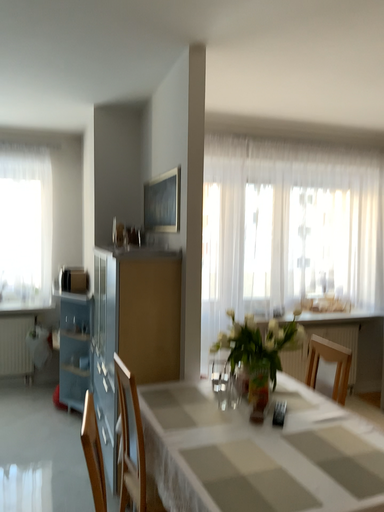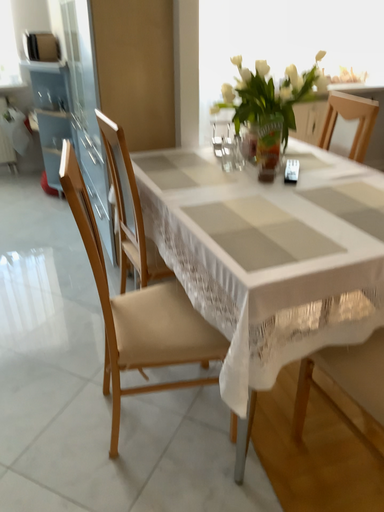
Question: How did the camera likely rotate when shooting the video?

Choices:
 (A) rotated downward
 (B) rotated upward

Answer: (A)